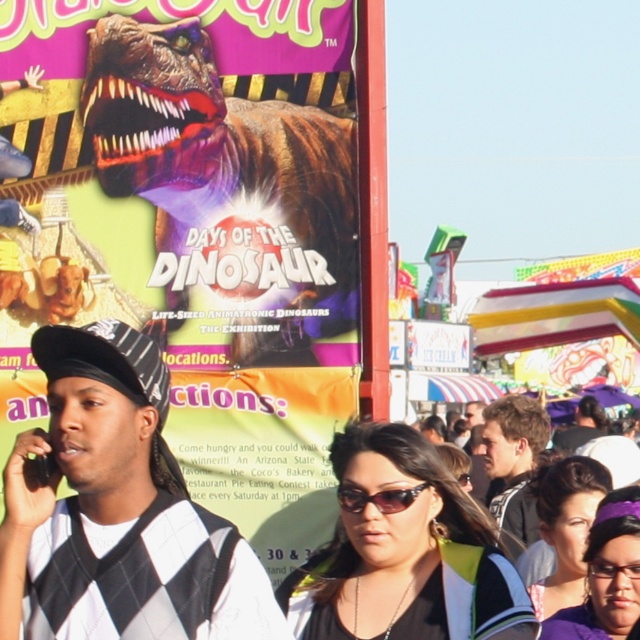
In the scene shown: Can you confirm if matte plastic dinosaur at upper left is thinner than black argyle sweater vest at left?

No.

Is matte plastic dinosaur at upper left to the left of black argyle sweater vest at left from the viewer's perspective?

Indeed, matte plastic dinosaur at upper left is positioned on the left side of black argyle sweater vest at left.

Is point (38, 396) farther from camera compared to point (99, 337)?

Yes, it is.

Where is `matte plastic dinosaur at upper left`? This screenshot has height=640, width=640. matte plastic dinosaur at upper left is located at coordinates point(195,228).

Who is more forward, (228,496) or (410,488)?

Point (410,488)

Is the position of matte plastic dinosaur at upper left less distant than that of black plastic sunglasses at center?

No.

Between point (308, 513) and point (403, 492), which one is positioned in front?

Point (403, 492) is more forward.

The image size is (640, 640). I want to click on matte plastic dinosaur at upper left, so click(x=195, y=228).

Based on the photo, is matte purple hair at lower right above dark brown hair at center?

Incorrect, matte purple hair at lower right is not positioned above dark brown hair at center.

Is point (572, 634) positioned after point (589, 406)?

No, (572, 634) is closer to viewer.

Locate an element on the screen. matte purple hair at lower right is located at coordinates (605, 573).